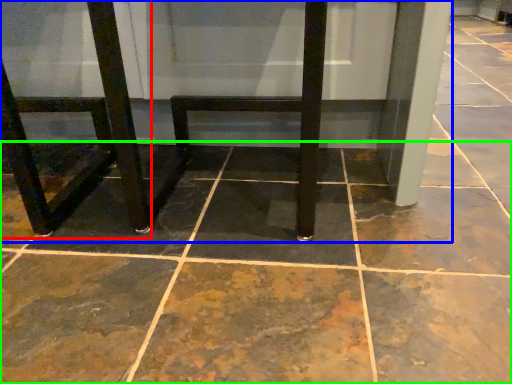
Question: Which object is positioned farthest from chair (highlighted by a red box)? Select from furniture (highlighted by a blue box) and concrete (highlighted by a green box).

Choices:
 (A) furniture
 (B) concrete

Answer: (B)